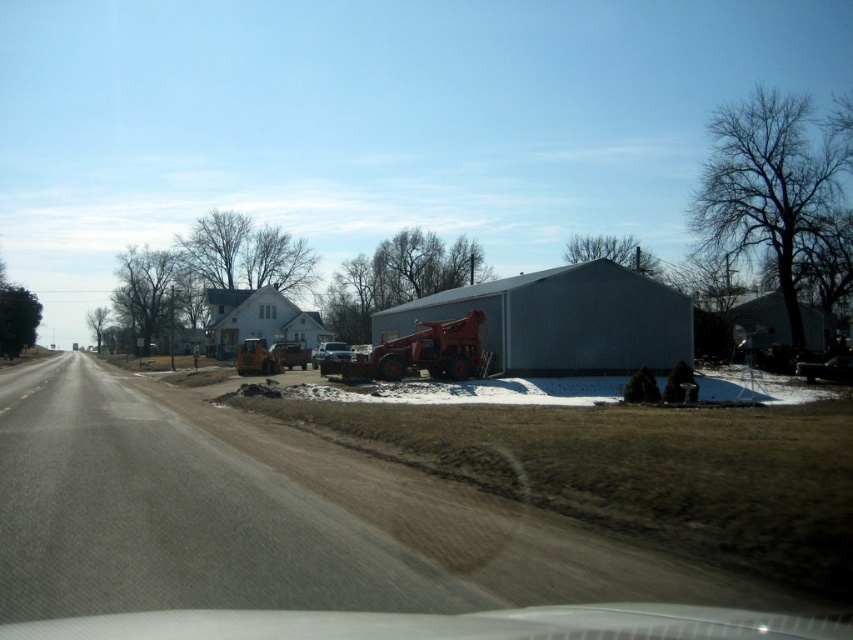
Does rusty metal tractor at center have a larger size compared to metallic yellow tractor at center?

No, rusty metal tractor at center is not bigger than metallic yellow tractor at center.

Can you confirm if rusty metal tractor at center is shorter than metallic yellow tractor at center?

No.

Which is behind, point (415, 356) or point (264, 340)?

The point (264, 340) is more distant.

You are a GUI agent. You are given a task and a screenshot of the screen. Output one action in this format:
    pyautogui.click(x=<x>, y=<y>)
    Task: Click on the rusty metal tractor at center
    This screenshot has height=640, width=853.
    Given the screenshot: What is the action you would take?
    pyautogui.click(x=421, y=353)

Between dirt track at lower left and metallic yellow tractor at center, which one appears on the left side from the viewer's perspective?

Positioned to the left is metallic yellow tractor at center.

Is dirt track at lower left closer to camera compared to metallic yellow tractor at center?

Yes, it is.

Is point (291, 476) positioned before point (273, 365)?

Yes, point (291, 476) is in front of point (273, 365).

Locate an element on the screen. The image size is (853, 640). dirt track at lower left is located at coordinates (274, 516).

Does rusty metal tractor at center have a smaller size compared to white matte house at center?

Yes.

Which is in front, point (381, 378) or point (244, 314)?

Point (381, 378)

Locate an element on the screen. This screenshot has height=640, width=853. rusty metal tractor at center is located at coordinates (421, 353).